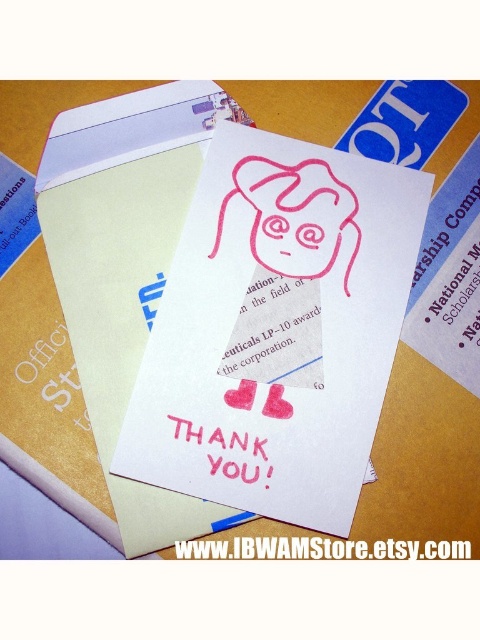
Does pink matte paper at center appear under pink matte thank you card at center?

Yes, pink matte paper at center is below pink matte thank you card at center.

Does pink matte paper at center lie behind pink matte thank you card at center?

No, it is not.

Does point (325, 556) come farther from viewer compared to point (217, 436)?

No, it is not.

Identify the location of pink matte paper at center. This screenshot has height=640, width=480. [321, 548].

Where is `pink matte paper card at center`? The image size is (480, 640). pink matte paper card at center is located at coordinates (276, 330).

Is point (224, 426) farther from camera compared to point (192, 548)?

Yes, it is behind point (192, 548).

Is pink matte paper card at center below pink matte paper at center?

Actually, pink matte paper card at center is above pink matte paper at center.

Describe the element at coordinates (276, 330) in the screenshot. Image resolution: width=480 pixels, height=640 pixels. I see `pink matte paper card at center` at that location.

I want to click on pink matte paper card at center, so click(276, 330).